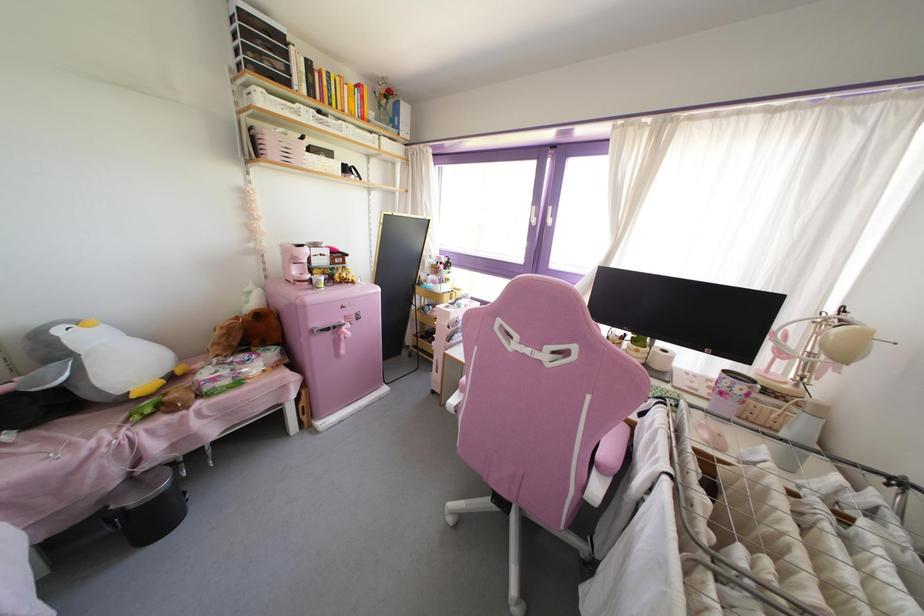
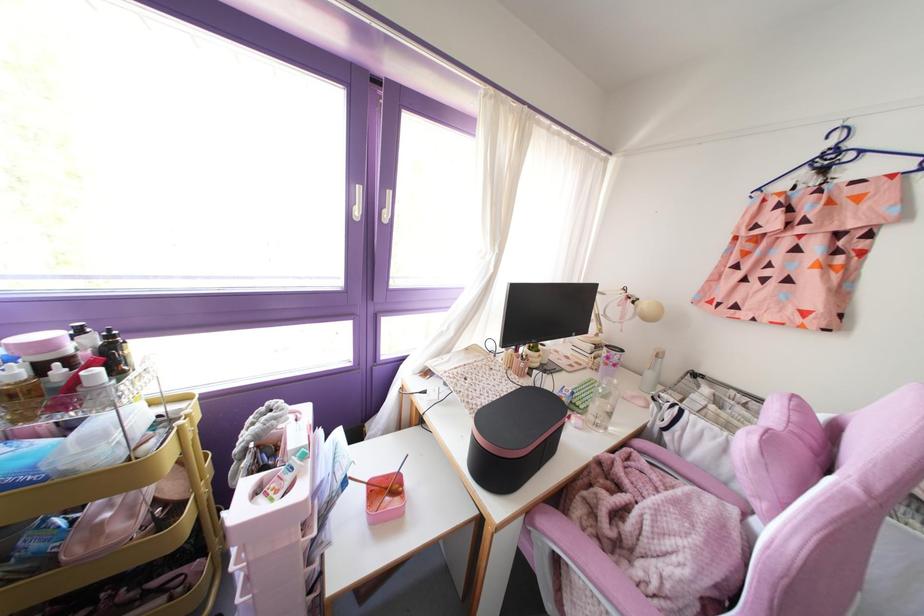
The point at (532, 220) is marked in the first image. Where is the corresponding point in the second image?

(357, 212)